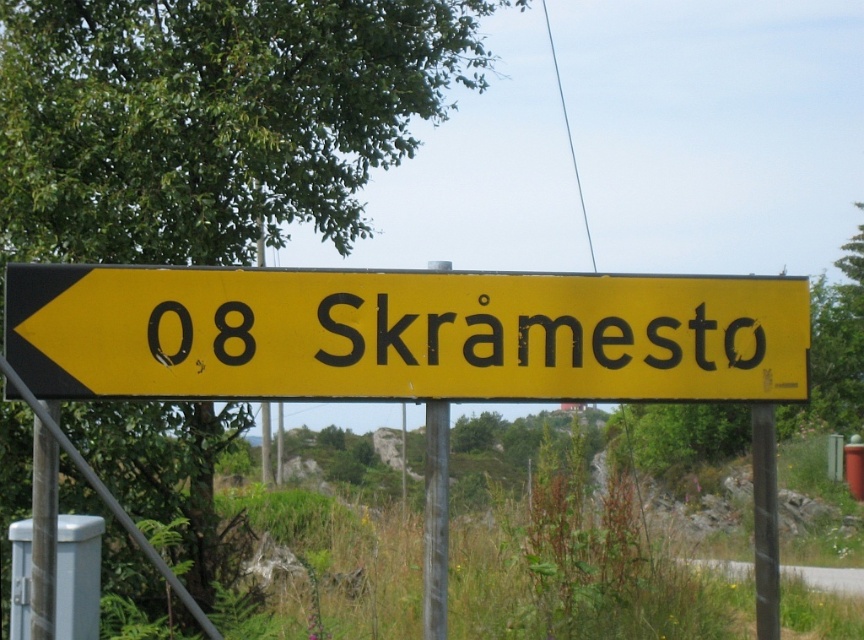
Question: Is yellow matte sign at center to the left of yellow/black text at center from the viewer's perspective?

Choices:
 (A) no
 (B) yes

Answer: (B)

Question: Among these points, which one is farthest from the camera?

Choices:
 (A) (293, 356)
 (B) (760, 356)

Answer: (B)

Question: Can you confirm if yellow matte sign at center is positioned to the left of yellow/black text at center?

Choices:
 (A) no
 (B) yes

Answer: (B)

Question: Which of the following is the closest to the observer?

Choices:
 (A) yellow matte sign at center
 (B) yellow/black text at center

Answer: (A)

Question: Does yellow matte sign at center have a lesser width compared to yellow/black text at center?

Choices:
 (A) yes
 (B) no

Answer: (B)